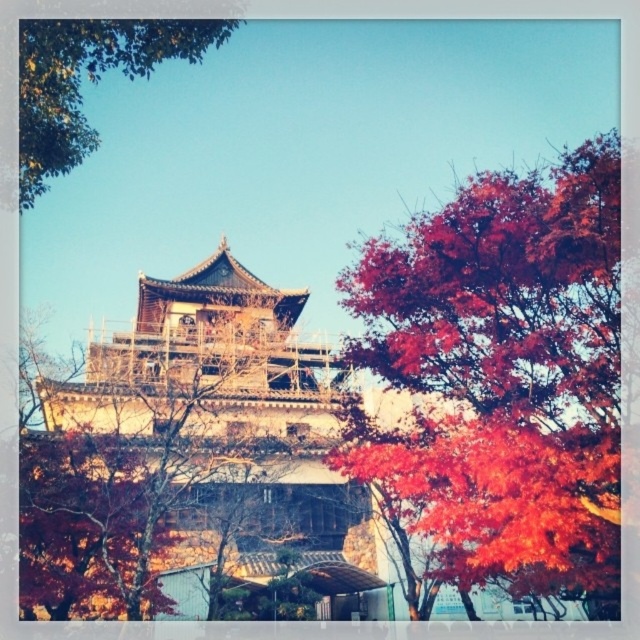
You are an architect observing the construction site and need to assess visibility of the green leafy tree at upper left. Are the vivid crimson leaves at right blocking your view of it?

The green leafy tree at upper left is behind the vivid crimson leaves at right, so yes, the vivid crimson leaves at right are blocking the view of the green leafy tree at upper left.

You are standing in front of the traditional East Asian building under renovation. You notice two points marked in the image. The first point is at coordinates point [620,360], and the second is at point [104,68]. Which of these points is nearer to your current position?

Point [620,360] is closer to the camera than point [104,68], so the first point is nearer to your current position.

You are an architect designing a new garden layout next to the traditional East Asian building. You need to ensure that the plants you choose will not block the view of the building. Considering the sizes of the vivid crimson leaves at right and the green leafy tree at upper left, which plant should you avoid planting near the building to prevent obstruction?

You should avoid planting the vivid crimson leaves at right near the building because their width is larger than the green leafy tree at upper left, making them more likely to block the view.